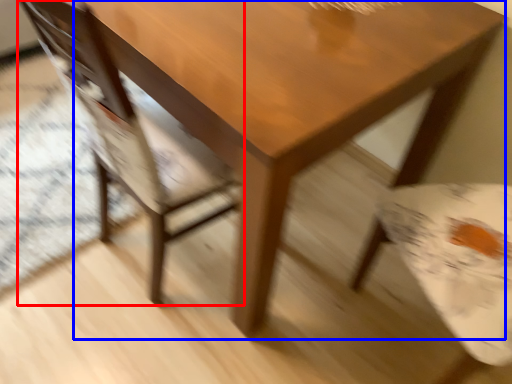
Question: Which point is closer to the camera, chair (highlighted by a red box) or table (highlighted by a blue box)?

Choices:
 (A) chair
 (B) table

Answer: (A)